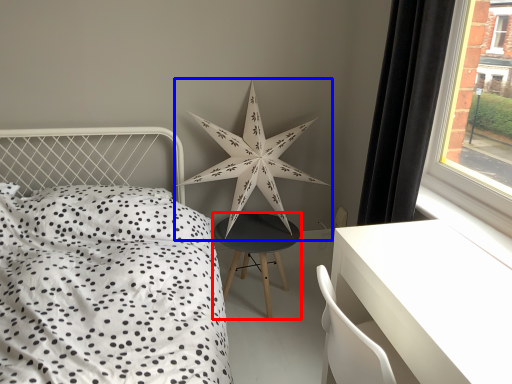
Question: Which object is further to the camera taking this photo, nightstand (highlighted by a red box) or star (highlighted by a blue box)?

Choices:
 (A) nightstand
 (B) star

Answer: (A)